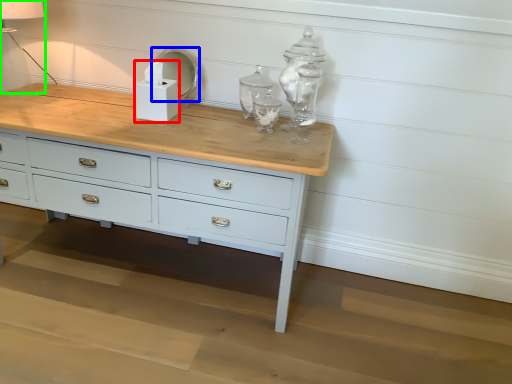
Question: Which object is the farthest from candle holder (highlighted by a red box)? Choose among these: mirror (highlighted by a blue box) or table lamp (highlighted by a green box).

Choices:
 (A) mirror
 (B) table lamp

Answer: (B)